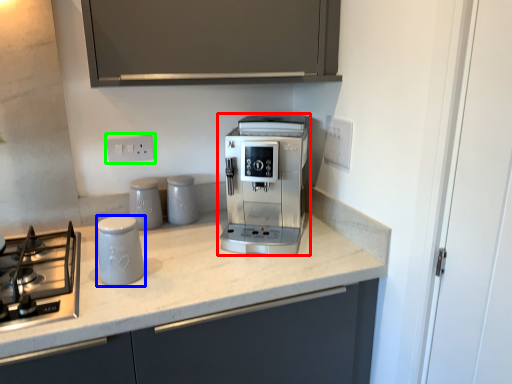
Question: Which object is positioned farthest from coffee maker (highlighted by a red box)? Select from kitchen appliance (highlighted by a blue box) and electric outlet (highlighted by a green box).

Choices:
 (A) kitchen appliance
 (B) electric outlet

Answer: (B)